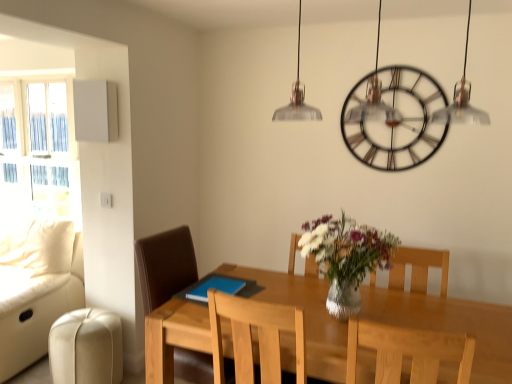
Question: Considering the relative sizes of white glass window at left and leather couch at left in the image provided, is white glass window at left thinner than leather couch at left?

Choices:
 (A) yes
 (B) no

Answer: (A)

Question: Is white glass window at left wider than leather couch at left?

Choices:
 (A) yes
 (B) no

Answer: (B)

Question: Considering the relative sizes of white glass window at left and leather couch at left in the image provided, is white glass window at left shorter than leather couch at left?

Choices:
 (A) no
 (B) yes

Answer: (A)

Question: From a real-world perspective, is white glass window at left on leather couch at left?

Choices:
 (A) yes
 (B) no

Answer: (A)

Question: Does white glass window at left appear on the right side of leather couch at left?

Choices:
 (A) yes
 (B) no

Answer: (B)

Question: Could you tell me if white glass window at left is turned towards leather couch at left?

Choices:
 (A) no
 (B) yes

Answer: (B)

Question: From the image's perspective, is brown leather chair at center, acting as the 1th chair starting from the back, below white glass window at left?

Choices:
 (A) no
 (B) yes

Answer: (B)

Question: Is brown leather chair at center, acting as the 1th chair starting from the back, at the left side of white glass window at left?

Choices:
 (A) yes
 (B) no

Answer: (B)

Question: Can you confirm if brown leather chair at center, which is the 1th chair in left-to-right order, is positioned to the right of white glass window at left?

Choices:
 (A) yes
 (B) no

Answer: (A)

Question: Does brown leather chair at center, acting as the 1th chair starting from the back, have a greater height compared to white glass window at left?

Choices:
 (A) no
 (B) yes

Answer: (A)

Question: Is brown leather chair at center, the second chair from the right, turned away from white glass window at left?

Choices:
 (A) yes
 (B) no

Answer: (A)

Question: Does brown leather chair at center, acting as the 1th chair starting from the back, have a greater width compared to white glass window at left?

Choices:
 (A) no
 (B) yes

Answer: (B)

Question: From a real-world perspective, is metallic/brass-toned clock at upper center physically above beige leather swivel chair at lower left?

Choices:
 (A) no
 (B) yes

Answer: (B)